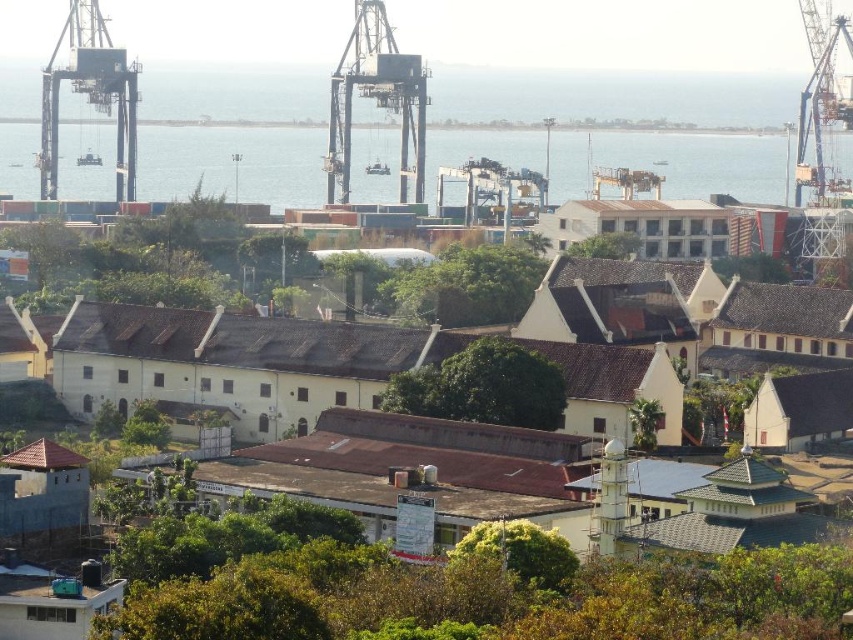
You are a photographer planning to capture the coastal urban area. You notice a point marked at coordinates (619, 129). What is located at this point in the scene?

The point at coordinates (619, 129) indicates blue water at upper center.

You are standing in the coastal urban area and want to locate the blue water at upper center. According to the coordinates provided, where should you look relative to the mosque with a prominent minaret?

The blue water at upper center is located at coordinates point 0.203 on the x axis and 0.727 on the y axis. Since the mosque is in the foreground, the blue water at upper center is above and to the left of the mosque.

What is the exact location of the blue water at upper center in the image?

The blue water at upper center is located at point (619, 129).